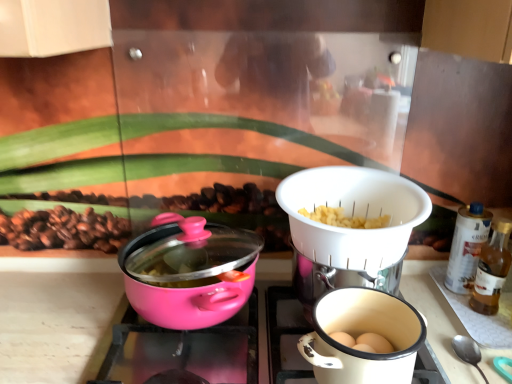
Question: In which direction should I rotate to look at pink matte pot at center, the first kitchen appliance when ordered from left to right?

Choices:
 (A) left
 (B) right

Answer: (A)

Question: Could you tell me if white plastic strainer at center, which is counted as the 1th kitchen appliance, starting from the right, is facing matte white coffee cup at lower right?

Choices:
 (A) no
 (B) yes

Answer: (A)

Question: Is the depth of white plastic strainer at center, which is counted as the 1th kitchen appliance, starting from the right, less than that of matte white coffee cup at lower right?

Choices:
 (A) no
 (B) yes

Answer: (A)

Question: From a real-world perspective, is white plastic strainer at center, marked as the 2th kitchen appliance in a left-to-right arrangement, positioned under matte white coffee cup at lower right based on gravity?

Choices:
 (A) yes
 (B) no

Answer: (B)

Question: Is white plastic strainer at center, marked as the 2th kitchen appliance in a left-to-right arrangement, not close to matte white coffee cup at lower right?

Choices:
 (A) yes
 (B) no

Answer: (B)

Question: Is white plastic strainer at center, marked as the 2th kitchen appliance in a left-to-right arrangement, bigger than matte white coffee cup at lower right?

Choices:
 (A) yes
 (B) no

Answer: (A)

Question: Considering the relative positions of white plastic strainer at center, which is counted as the 1th kitchen appliance, starting from the right, and matte white coffee cup at lower right in the image provided, is white plastic strainer at center, which is counted as the 1th kitchen appliance, starting from the right, to the right of matte white coffee cup at lower right from the viewer's perspective?

Choices:
 (A) no
 (B) yes

Answer: (B)

Question: Is matte white coffee cup at lower right oriented towards pink glossy pot at center?

Choices:
 (A) yes
 (B) no

Answer: (B)

Question: Is matte white coffee cup at lower right smaller than pink glossy pot at center?

Choices:
 (A) yes
 (B) no

Answer: (A)

Question: Is matte white coffee cup at lower right positioned with its back to pink glossy pot at center?

Choices:
 (A) no
 (B) yes

Answer: (A)

Question: Considering the relative positions of matte white coffee cup at lower right and pink glossy pot at center in the image provided, is matte white coffee cup at lower right behind pink glossy pot at center?

Choices:
 (A) no
 (B) yes

Answer: (A)

Question: Can pink glossy pot at center be found inside matte white coffee cup at lower right?

Choices:
 (A) yes
 (B) no

Answer: (B)

Question: Is matte white coffee cup at lower right bigger than pink glossy pot at center?

Choices:
 (A) yes
 (B) no

Answer: (B)

Question: Is matte white coffee cup at lower right looking in the opposite direction of white plastic strainer at center, which is counted as the 1th kitchen appliance, starting from the right?

Choices:
 (A) yes
 (B) no

Answer: (B)